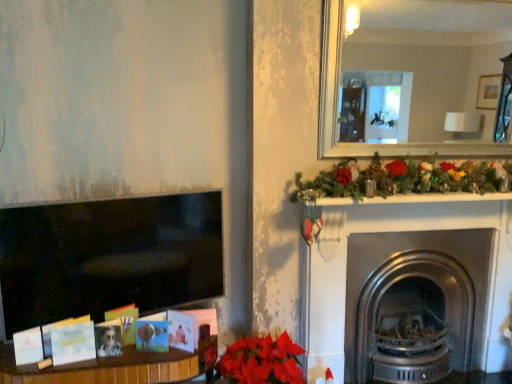
Question: Is vibrant matte poinsettia at lower center not inside stainless steel fireplace at right?

Choices:
 (A) no
 (B) yes

Answer: (B)

Question: Does vibrant matte poinsettia at lower center come behind stainless steel fireplace at right?

Choices:
 (A) no
 (B) yes

Answer: (A)

Question: Considering the relative positions of vibrant matte poinsettia at lower center and stainless steel fireplace at right in the image provided, is vibrant matte poinsettia at lower center to the right of stainless steel fireplace at right from the viewer's perspective?

Choices:
 (A) no
 (B) yes

Answer: (A)

Question: From the image's perspective, does vibrant matte poinsettia at lower center appear higher than stainless steel fireplace at right?

Choices:
 (A) yes
 (B) no

Answer: (B)

Question: Are vibrant matte poinsettia at lower center and stainless steel fireplace at right located far from each other?

Choices:
 (A) yes
 (B) no

Answer: (B)

Question: Is vibrant matte poinsettia at lower center positioned with its back to stainless steel fireplace at right?

Choices:
 (A) no
 (B) yes

Answer: (A)

Question: Is stainless steel fireplace at right shorter than vibrant matte poinsettia at lower center?

Choices:
 (A) no
 (B) yes

Answer: (A)

Question: Can you confirm if stainless steel fireplace at right is positioned to the right of vibrant matte poinsettia at lower center?

Choices:
 (A) no
 (B) yes

Answer: (B)

Question: Considering the relative sizes of stainless steel fireplace at right and vibrant matte poinsettia at lower center in the image provided, is stainless steel fireplace at right wider than vibrant matte poinsettia at lower center?

Choices:
 (A) no
 (B) yes

Answer: (A)

Question: From a real-world perspective, is stainless steel fireplace at right located beneath vibrant matte poinsettia at lower center?

Choices:
 (A) no
 (B) yes

Answer: (A)

Question: From the image's perspective, is stainless steel fireplace at right above vibrant matte poinsettia at lower center?

Choices:
 (A) yes
 (B) no

Answer: (A)

Question: From a real-world perspective, is stainless steel fireplace at right on top of vibrant matte poinsettia at lower center?

Choices:
 (A) yes
 (B) no

Answer: (A)

Question: Considering the positions of point (437, 223) and point (224, 370), is point (437, 223) closer or farther from the camera than point (224, 370)?

Choices:
 (A) closer
 (B) farther

Answer: (B)